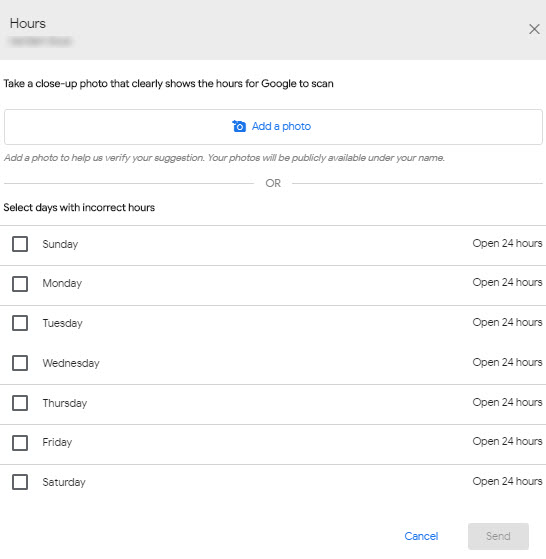
Image resolution: width=546 pixels, height=559 pixels. I want to click on exit button, so coord(532,29).